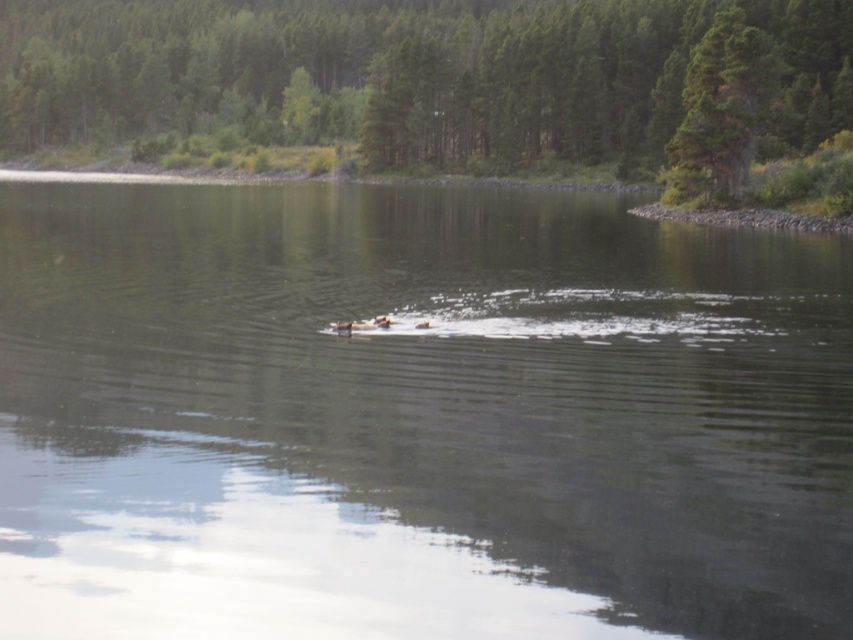
Is point (381, 541) closer to viewer compared to point (724, 49)?

That is True.

Is clear water at center smaller than green textured tree at upper center?

Indeed, clear water at center has a smaller size compared to green textured tree at upper center.

Is point (68, 307) more distant than point (254, 164)?

No.

Where is `clear water at center`? This screenshot has height=640, width=853. clear water at center is located at coordinates (415, 417).